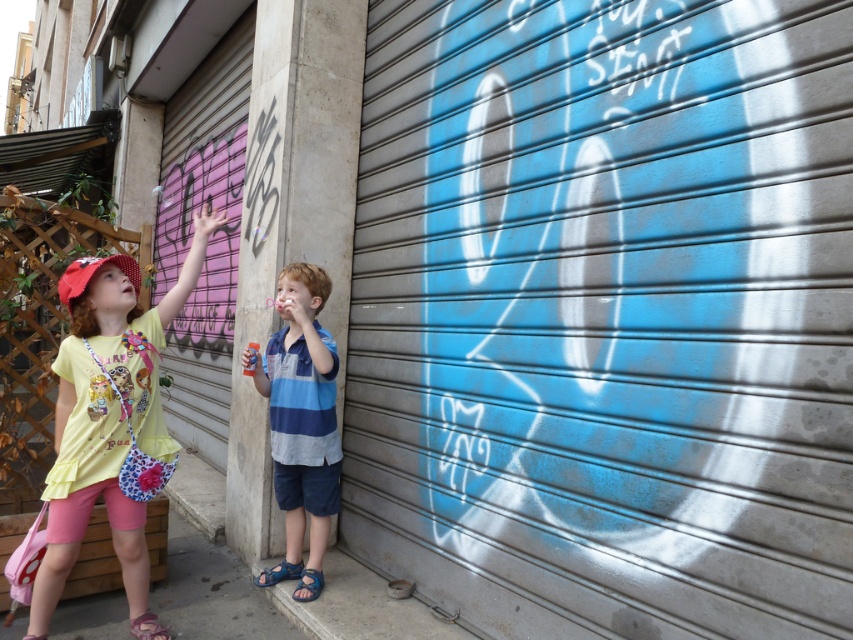
How much distance is there between metallic silver garage door at center and blue striped shirt at center?

The distance of metallic silver garage door at center from blue striped shirt at center is 34.57 inches.

Is metallic silver garage door at center behind blue striped shirt at center?

No, metallic silver garage door at center is in front of blue striped shirt at center.

Consider the image. Who is more distant from viewer, (670, 348) or (325, 534)?

The point (325, 534) is more distant.

Locate an element on the screen. The image size is (853, 640). metallic silver garage door at center is located at coordinates click(605, 316).

Looking at this image, is metallic silver garage door at center below yellow fabric shirt at upper left?

Incorrect, metallic silver garage door at center is not positioned below yellow fabric shirt at upper left.

Who is more distant from viewer, (491,609) or (113,394)?

The point (491,609) is behind.

Does point (714, 321) come farther from viewer compared to point (59, 464)?

No, (714, 321) is in front of (59, 464).

I want to click on metallic silver garage door at center, so click(605, 316).

From the picture: Between yellow fabric shirt at upper left and blue striped shirt at center, which one has more height?

Standing taller between the two is yellow fabric shirt at upper left.

Can you confirm if yellow fabric shirt at upper left is thinner than blue striped shirt at center?

Incorrect, yellow fabric shirt at upper left's width is not less than blue striped shirt at center's.

Between point (36, 596) and point (328, 509), which one is positioned in front?

Point (36, 596) is more forward.

Where is `yellow fabric shirt at upper left`? Image resolution: width=853 pixels, height=640 pixels. yellow fabric shirt at upper left is located at coordinates (109, 417).